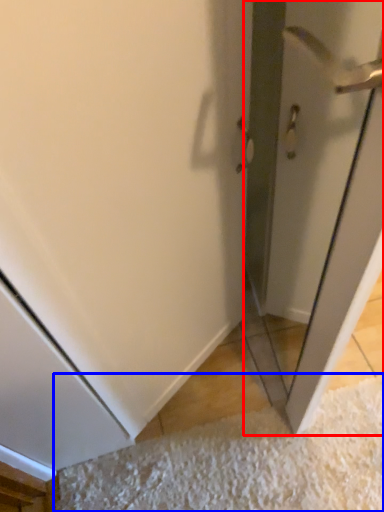
Question: Which object appears closest to the camera in this image, screen door (highlighted by a red box) or doormat (highlighted by a blue box)?

Choices:
 (A) screen door
 (B) doormat

Answer: (A)